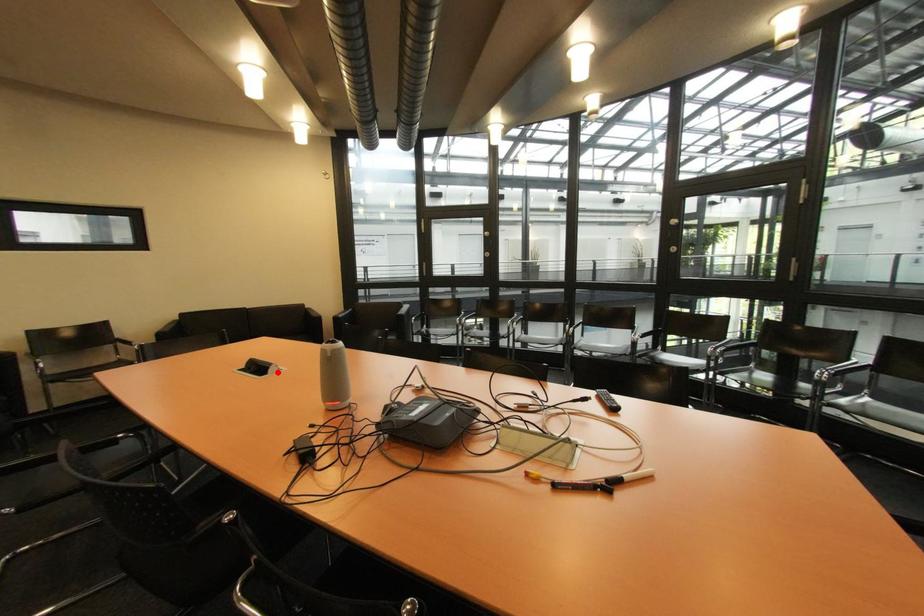
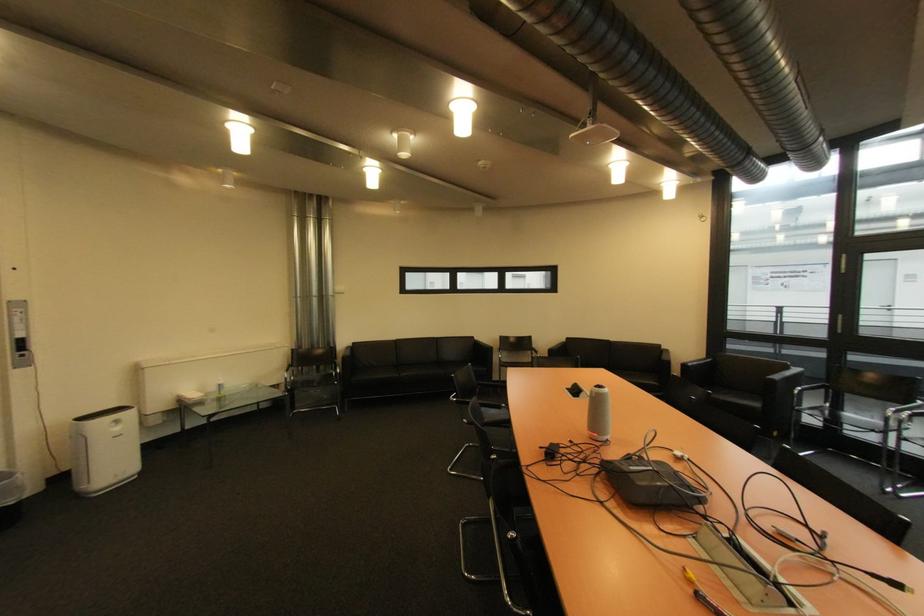
Find the pixel in the second image that matches the highlighted location in the first image.

(590, 397)